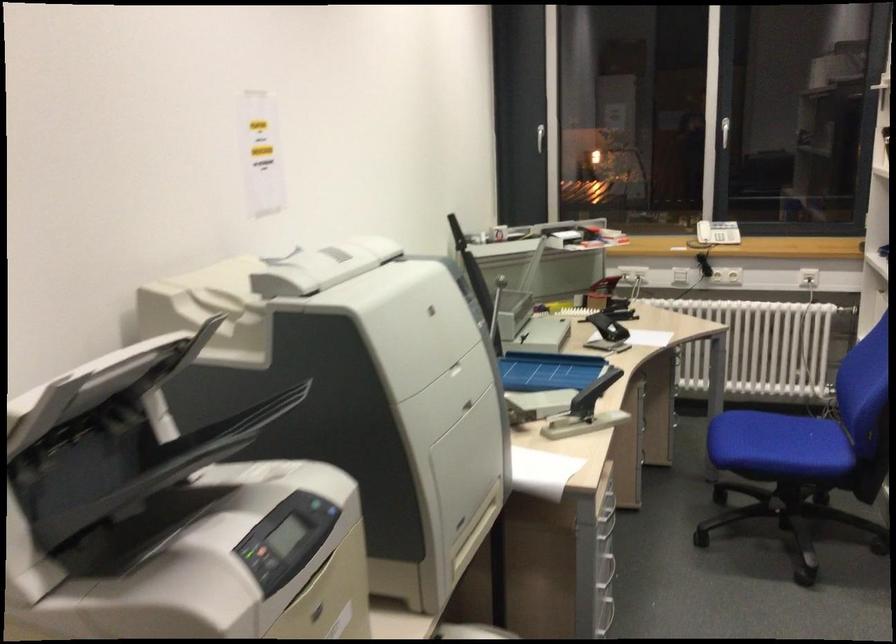
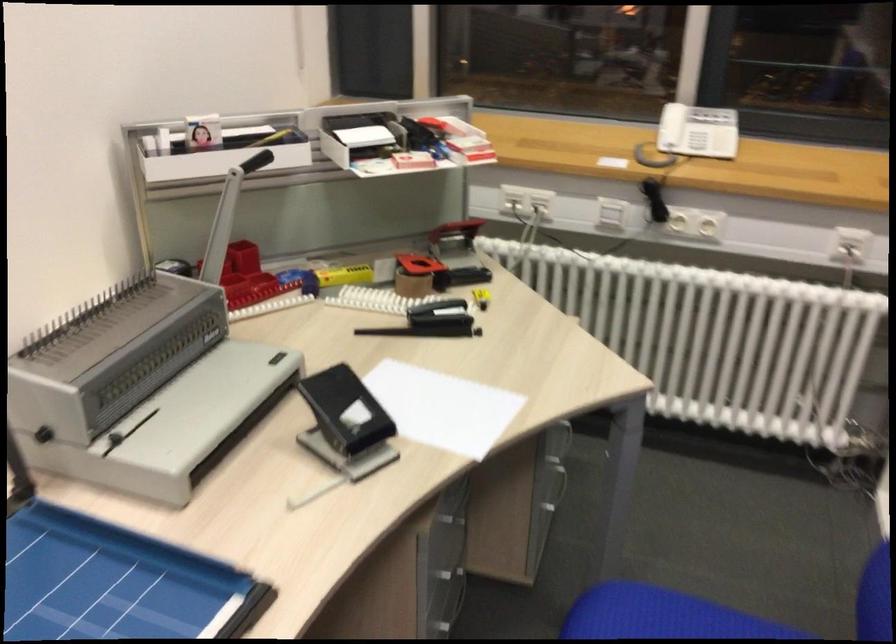
In the second image, find the point that corresponds to [533,252] in the first image.

(228, 216)